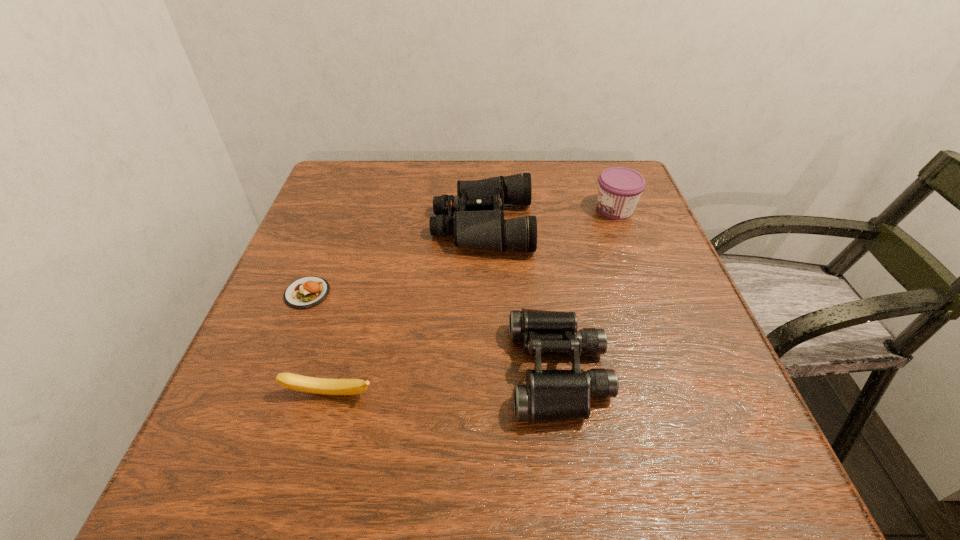
Where is `vacant space that satisfies the following two spatial constraints: 1. through the eyepieces of the farther binoculars; 2. at the stem of the banana`? This screenshot has width=960, height=540. vacant space that satisfies the following two spatial constraints: 1. through the eyepieces of the farther binoculars; 2. at the stem of the banana is located at coordinates (484, 394).

Identify the location of vacant space that satisfies the following two spatial constraints: 1. on the front-facing side of the nearer binoculars; 2. at the stem of the fourth tallest object. The image size is (960, 540). (563, 394).

The image size is (960, 540). What are the coordinates of `free space that satisfies the following two spatial constraints: 1. on the front-facing side of the nearer binoculars; 2. at the stem of the banana` in the screenshot? It's located at coord(563,394).

You are a GUI agent. You are given a task and a screenshot of the screen. Output one action in this format:
    pyautogui.click(x=<x>, y=<y>)
    Task: Click on the free space that satisfies the following two spatial constraints: 1. on the front label of the jam; 2. at the stem of the banana
    
    Given the screenshot: What is the action you would take?
    pyautogui.click(x=684, y=394)

Where is `free spot that satisfies the following two spatial constraints: 1. on the front label of the rightmost object; 2. at the stem of the second shortest object`? free spot that satisfies the following two spatial constraints: 1. on the front label of the rightmost object; 2. at the stem of the second shortest object is located at coordinates (684, 394).

Where is `free spot that satisfies the following two spatial constraints: 1. on the front label of the jam; 2. at the stem of the banana`? This screenshot has height=540, width=960. free spot that satisfies the following two spatial constraints: 1. on the front label of the jam; 2. at the stem of the banana is located at coordinates (684, 394).